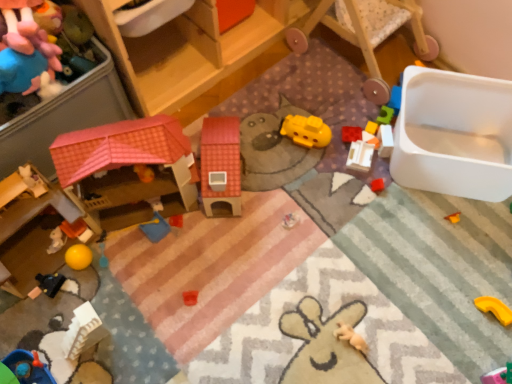
Find the location of a particular element. The height and width of the screenshot is (384, 512). vacant space that's between yellow rubber toy at lower right, positioned as the 11th toy in left-to-right order, and white plastic building at center-right, positioned as the 4th toy in right-to-left order is located at coordinates (423, 231).